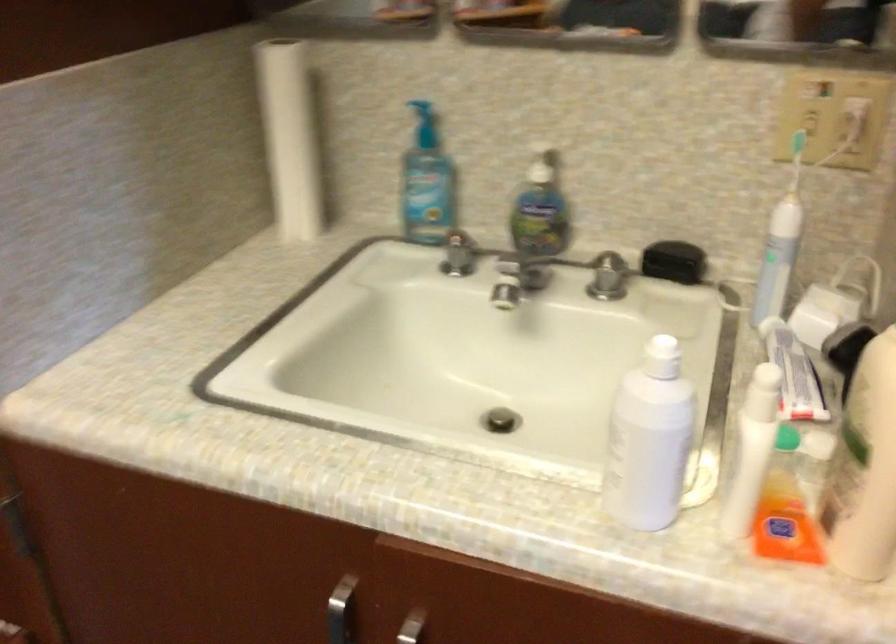
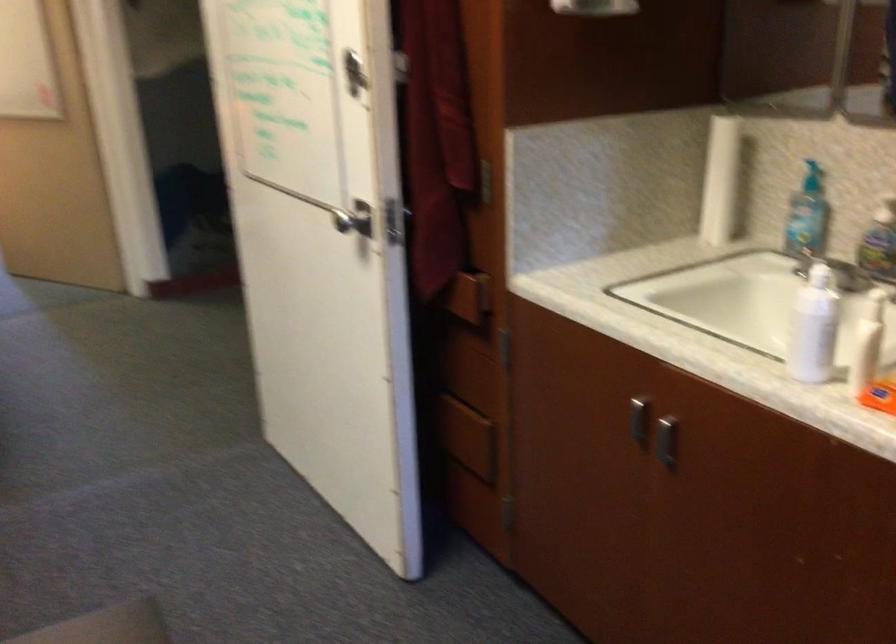
Question: The camera is either moving clockwise (left) or counter-clockwise (right) around the object. The first image is from the beginning of the video and the second image is from the end. Is the camera moving left or right when shooting the video?

Choices:
 (A) Left
 (B) Right

Answer: (B)